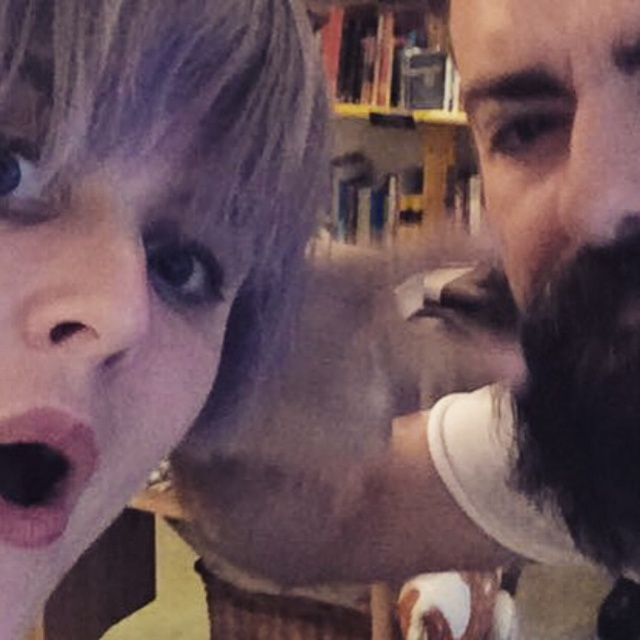
You are a photographer adjusting the lighting for a portrait. You notice the smooth skin face at center and the pink matte lips at center in your frame. Which feature should you focus on to ensure proper exposure for the subject?

The smooth skin face at center is positioned over the pink matte lips at center, so focusing on the smooth skin face at center will ensure proper exposure since it is the more prominent feature in the composition.

You are taking a photo of the scene and want to focus on both point (58, 260) and point (419, 492). Which point should you adjust your focus to first to ensure both are in focus?

Point (58, 260) is closer to the camera than point (419, 492), so you should focus on point (58, 260) first to ensure both are in focus.

You are a photographer trying to capture a portrait of the dark brown beard at right and the pink matte lips at center. Which object is located to the right of the other?

The dark brown beard at right is positioned on the right side of pink matte lips at center, so the dark brown beard at right is to the right of the pink matte lips at center.